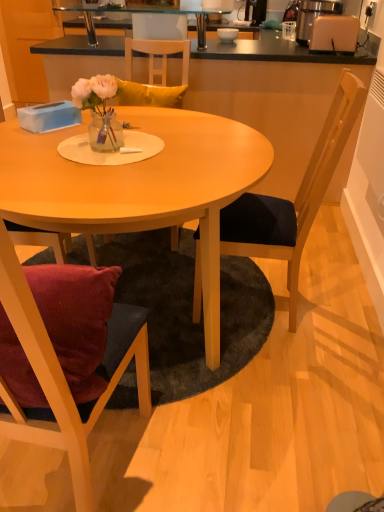
Find the location of `free location in front of matte white bowl at upper center`. free location in front of matte white bowl at upper center is located at coordinates (223, 45).